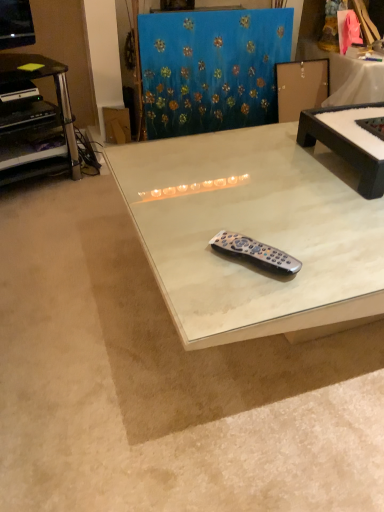
Locate an element on the screen. This screenshot has height=512, width=384. free spot to the right of black plastic desk at left is located at coordinates (92, 193).